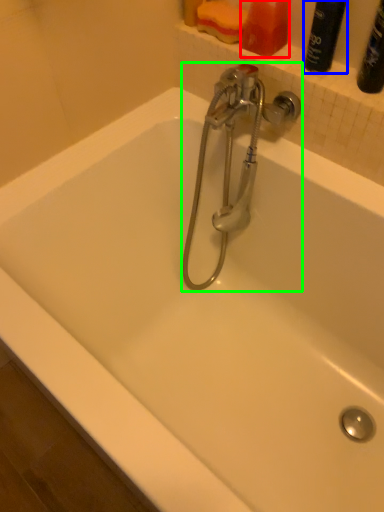
Question: Considering the real-world distances, which object is farthest from toiletry (highlighted by a red box)? cleaning product (highlighted by a blue box) or tap (highlighted by a green box)?

Choices:
 (A) cleaning product
 (B) tap

Answer: (B)